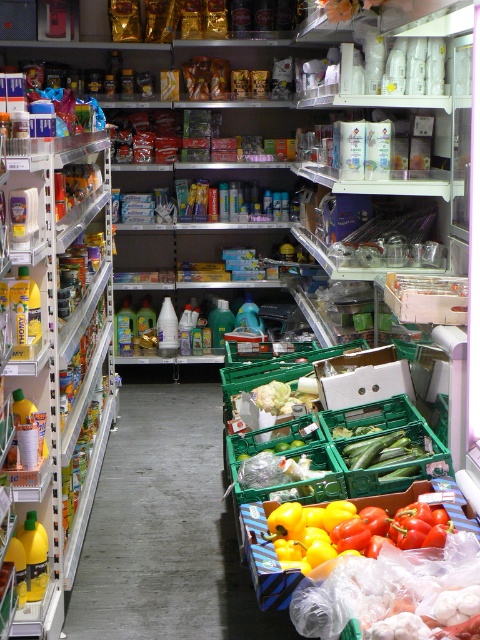
Question: Does green plastic crate at center have a larger size compared to yellow matte bell pepper at center?

Choices:
 (A) yes
 (B) no

Answer: (A)

Question: Is green plastic crate at center wider than yellow matte bell pepper at center?

Choices:
 (A) no
 (B) yes

Answer: (B)

Question: Among these objects, which one is nearest to the camera?

Choices:
 (A) green plastic crate at center
 (B) yellow matte bell pepper at center

Answer: (B)

Question: Which point appears closest to the camera in this image?

Choices:
 (A) (172, 536)
 (B) (337, 554)

Answer: (B)

Question: Observing the image, what is the correct spatial positioning of green plastic crate at center in reference to yellow matte bell pepper at center?

Choices:
 (A) right
 (B) left

Answer: (B)